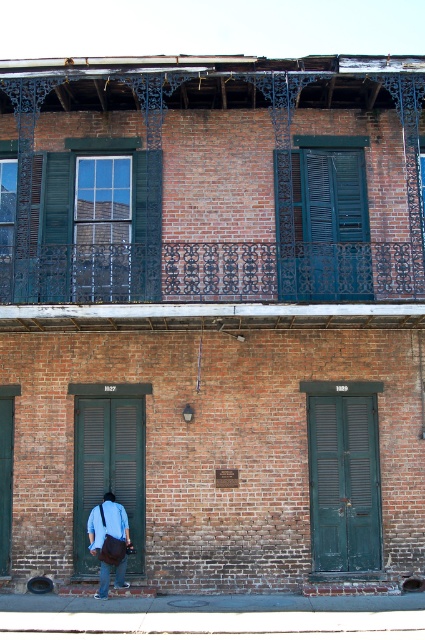
Between dark teal wrought iron balcony at upper center and white matte dress shirt at lower left, which one is positioned higher?

dark teal wrought iron balcony at upper center is higher up.

Based on the photo, who is taller, dark teal wrought iron balcony at upper center or white matte dress shirt at lower left?

With more height is dark teal wrought iron balcony at upper center.

At what (x,y) coordinates should I click in order to perform the action: click on dark teal wrought iron balcony at upper center. Please return your answer as a coordinate pair (x, y). The image size is (425, 640). Looking at the image, I should click on (217, 285).

You are a GUI agent. You are given a task and a screenshot of the screen. Output one action in this format:
    pyautogui.click(x=<x>, y=<y>)
    Task: Click on the green wrought iron balcony at upper center
    This screenshot has height=640, width=425.
    Given the screenshot: What is the action you would take?
    pyautogui.click(x=195, y=205)

You are a GUI agent. You are given a task and a screenshot of the screen. Output one action in this format:
    pyautogui.click(x=<x>, y=<y>)
    Task: Click on the green wrought iron balcony at upper center
    The image size is (425, 640).
    Given the screenshot: What is the action you would take?
    pyautogui.click(x=195, y=205)

Locate an element on the screen. This screenshot has height=640, width=425. green wrought iron balcony at upper center is located at coordinates (195, 205).

Is dark teal wrought iron balcony at upper center closer to camera compared to denim jacket at lower left?

No, dark teal wrought iron balcony at upper center is further to the viewer.

Does dark teal wrought iron balcony at upper center have a greater width compared to denim jacket at lower left?

Yes, dark teal wrought iron balcony at upper center is wider than denim jacket at lower left.

Does point (320, 301) come farther from viewer compared to point (96, 547)?

No, it is in front of (96, 547).

Locate an element on the screen. Image resolution: width=425 pixels, height=640 pixels. dark teal wrought iron balcony at upper center is located at coordinates (217, 285).